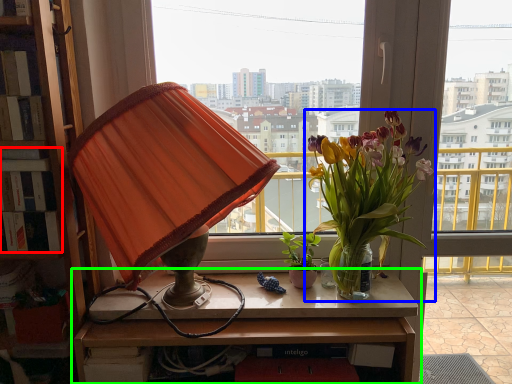
Question: Considering the real-world distances, which object is farthest from book (highlighted by a red box)? houseplant (highlighted by a blue box) or table (highlighted by a green box)?

Choices:
 (A) houseplant
 (B) table

Answer: (A)